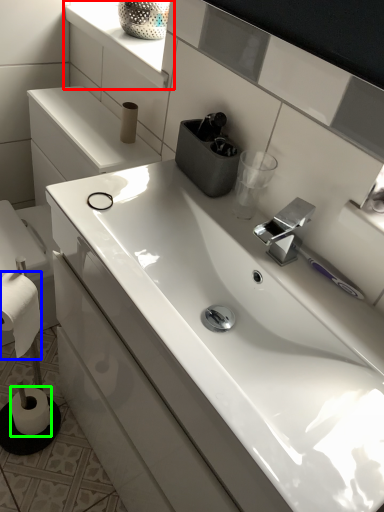
Question: Estimate the real-world distances between objects in this image. Which object is closer to window sill (highlighted by a red box), toilet paper (highlighted by a blue box) or toilet paper (highlighted by a green box)?

Choices:
 (A) toilet paper
 (B) toilet paper

Answer: (A)